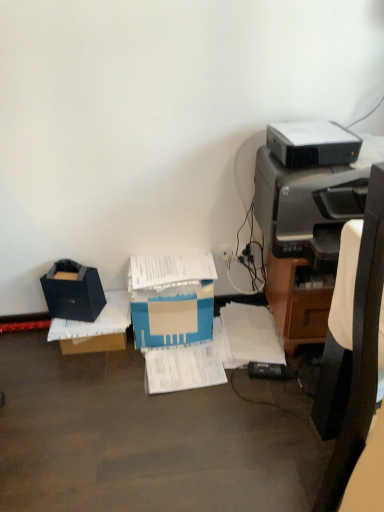
This screenshot has width=384, height=512. What do you see at coordinates (73, 292) in the screenshot?
I see `black fabric bag at left, the first storage box viewed from the top` at bounding box center [73, 292].

You are a GUI agent. You are given a task and a screenshot of the screen. Output one action in this format:
    pyautogui.click(x=<x>, y=<y>)
    Task: Click on the black plastic printer at right, which ranks as the 1th printer in bottom-to-top order
    This screenshot has width=384, height=512.
    Given the screenshot: What is the action you would take?
    pyautogui.click(x=306, y=205)

Identify the location of white paper at lower right, positioned as the first document in right-to-left order. (249, 335).

What's the angular difference between black fabric bag at left, which is counted as the second storage box, starting from the bottom, and matte black storage box at left, which is counted as the first storage box, starting from the bottom,'s facing directions?

They differ by 19.6 degrees in their facing directions.

Does point (48, 293) come in front of point (124, 310)?

No, (48, 293) is behind (124, 310).

Is black fabric bag at left, which is counted as the second storage box, starting from the bottom, completely or partially outside of matte black storage box at left, the 2th storage box positioned from the top?

black fabric bag at left, which is counted as the second storage box, starting from the bottom, lies outside matte black storage box at left, the 2th storage box positioned from the top,'s area.

Could you tell me if black fabric bag at left, which is counted as the second storage box, starting from the bottom, is facing matte black storage box at left, the 2th storage box positioned from the top?

No, black fabric bag at left, which is counted as the second storage box, starting from the bottom, does not turn towards matte black storage box at left, the 2th storage box positioned from the top.

From the image's perspective, between black plastic printer at upper right, placed as the first printer when sorted from top to bottom, and black plastic printer at right, which ranks as the 2th printer in top-to-bottom order, which one is located above?

From the image's view, black plastic printer at upper right, placed as the first printer when sorted from top to bottom, is above.

Considering the sizes of objects black plastic printer at upper right, arranged as the 2th printer when ordered from the bottom, and black plastic printer at right, which ranks as the 1th printer in bottom-to-top order, in the image provided, who is smaller, black plastic printer at upper right, arranged as the 2th printer when ordered from the bottom, or black plastic printer at right, which ranks as the 1th printer in bottom-to-top order,?

With smaller size is black plastic printer at upper right, arranged as the 2th printer when ordered from the bottom.

Which is in front, point (301, 154) or point (316, 186)?

The point (301, 154) is closer.

Considering the relative sizes of black plastic printer at upper right, placed as the first printer when sorted from top to bottom, and black plastic printer at right, which ranks as the 2th printer in top-to-bottom order, in the image provided, is black plastic printer at upper right, placed as the first printer when sorted from top to bottom, wider than black plastic printer at right, which ranks as the 2th printer in top-to-bottom order,?

No.

Is blue cardboard box at center shorter than white paper at lower right, placed as the second document when sorted from left to right?

In fact, blue cardboard box at center may be taller than white paper at lower right, placed as the second document when sorted from left to right.

Is blue cardboard box at center inside or outside of white paper at lower right, placed as the second document when sorted from left to right?

blue cardboard box at center is not enclosed by white paper at lower right, placed as the second document when sorted from left to right.

Considering their positions, is blue cardboard box at center located in front of or behind white paper at lower right, positioned as the first document in right-to-left order?

In the image, blue cardboard box at center appears in front of white paper at lower right, positioned as the first document in right-to-left order.

Is blue cardboard box at center turned away from white paper at lower right, placed as the second document when sorted from left to right?

No, blue cardboard box at center is not facing the opposite direction of white paper at lower right, placed as the second document when sorted from left to right.

Is black plastic printer at upper right, arranged as the 2th printer when ordered from the bottom, surrounded by black plastic chair at right?

No, black plastic printer at upper right, arranged as the 2th printer when ordered from the bottom, is not surrounded by black plastic chair at right.

Does point (353, 397) lie in front of point (315, 149)?

Yes, point (353, 397) is in front of point (315, 149).

From a real-world perspective, is black plastic chair at right on top of black plastic printer at upper right, placed as the first printer when sorted from top to bottom?

Incorrect, from a real-world perspective, black plastic chair at right is lower than black plastic printer at upper right, placed as the first printer when sorted from top to bottom.

Which is more to the left, black plastic chair at right or black plastic printer at upper right, placed as the first printer when sorted from top to bottom?

black plastic printer at upper right, placed as the first printer when sorted from top to bottom, is more to the left.

Is white paper at center, which is the second document from right to left, not close to black plastic chair at right?

No, white paper at center, which is the second document from right to left, is not far from black plastic chair at right.

What's the angular difference between white paper at center, placed as the 1th document when sorted from left to right, and black plastic chair at right's facing directions?

There is a 85.6-degree angle between the facing directions of white paper at center, placed as the 1th document when sorted from left to right, and black plastic chair at right.

Would you say white paper at center, placed as the 1th document when sorted from left to right, is outside black plastic chair at right?

white paper at center, placed as the 1th document when sorted from left to right, is positioned outside black plastic chair at right.

Can you confirm if white paper at center, placed as the 1th document when sorted from left to right, is wider than black plastic chair at right?

No.

Considering the sizes of white paper at lower right, placed as the second document when sorted from left to right, and black plastic chair at right in the image, is white paper at lower right, placed as the second document when sorted from left to right, bigger or smaller than black plastic chair at right?

white paper at lower right, placed as the second document when sorted from left to right, is smaller than black plastic chair at right.

Which object is more forward, white paper at lower right, positioned as the first document in right-to-left order, or black plastic chair at right?

Positioned in front is black plastic chair at right.

From a real-world perspective, is white paper at lower right, positioned as the first document in right-to-left order, positioned under black plastic chair at right based on gravity?

Yes, from a real-world perspective, white paper at lower right, positioned as the first document in right-to-left order, is below black plastic chair at right.

From the image's perspective, count 1st printers upward from the blue cardboard box at center and point to it. Please provide its 2D coordinates.

[(306, 205)]

From a real-world perspective, which object rests below the other?

blue cardboard box at center is physically lower.

Which is in front, point (295, 233) or point (194, 328)?

Positioned in front is point (295, 233).

In terms of size, does black plastic printer at right, which ranks as the 2th printer in top-to-bottom order, appear bigger or smaller than blue cardboard box at center?

Considering their sizes, black plastic printer at right, which ranks as the 2th printer in top-to-bottom order, takes up more space than blue cardboard box at center.

Where is `storage box above the matte black storage box at left, which is counted as the first storage box, starting from the bottom (from the image's perspective)`? The width and height of the screenshot is (384, 512). storage box above the matte black storage box at left, which is counted as the first storage box, starting from the bottom (from the image's perspective) is located at coordinates (73, 292).

Where is `printer behind the black plastic printer at right, which ranks as the 2th printer in top-to-bottom order`? The image size is (384, 512). printer behind the black plastic printer at right, which ranks as the 2th printer in top-to-bottom order is located at coordinates tap(312, 144).

From the picture: Estimate the real-world distances between objects in this image. Which object is further from matte black printer at right, black plastic printer at right, which ranks as the 1th printer in bottom-to-top order, or black fabric bag at left, which is counted as the second storage box, starting from the bottom?

black fabric bag at left, which is counted as the second storage box, starting from the bottom, lies further to matte black printer at right than the other object.

From the picture: From the image, which object appears to be nearer to matte black printer at right, matte black storage box at left, which is counted as the first storage box, starting from the bottom, or black plastic printer at right, which ranks as the 1th printer in bottom-to-top order?

black plastic printer at right, which ranks as the 1th printer in bottom-to-top order.

Based on the photo, when comparing their distances from matte black printer at right, does white paper at center, which is the second document from right to left, or black fabric bag at left, which is counted as the second storage box, starting from the bottom, seem closer?

white paper at center, which is the second document from right to left, is closer to matte black printer at right.

When comparing their distances from black plastic printer at right, which ranks as the 1th printer in bottom-to-top order, does matte black storage box at left, the 2th storage box positioned from the top, or black fabric bag at left, which is counted as the second storage box, starting from the bottom, seem closer?

matte black storage box at left, the 2th storage box positioned from the top, lies closer to black plastic printer at right, which ranks as the 1th printer in bottom-to-top order, than the other object.

Estimate the real-world distances between objects in this image. Which object is further from black fabric bag at left, the first storage box viewed from the top, white paper at center, placed as the 1th document when sorted from left to right, or black plastic printer at upper right, placed as the first printer when sorted from top to bottom?

black plastic printer at upper right, placed as the first printer when sorted from top to bottom, is positioned further to the anchor black fabric bag at left, the first storage box viewed from the top.

From the image, which object appears to be farther from white paper at lower right, positioned as the first document in right-to-left order, matte black printer at right or black plastic printer at right, which ranks as the 2th printer in top-to-bottom order?

The object further to white paper at lower right, positioned as the first document in right-to-left order, is black plastic printer at right, which ranks as the 2th printer in top-to-bottom order.

Which object lies further to the anchor point black plastic chair at right, black fabric bag at left, the first storage box viewed from the top, or matte black storage box at left, which is counted as the first storage box, starting from the bottom?

black fabric bag at left, the first storage box viewed from the top.

Looking at the image, which one is located further to black plastic printer at right, which ranks as the 1th printer in bottom-to-top order, matte black printer at right or black plastic printer at upper right, arranged as the 2th printer when ordered from the bottom?

black plastic printer at upper right, arranged as the 2th printer when ordered from the bottom, lies further to black plastic printer at right, which ranks as the 1th printer in bottom-to-top order, than the other object.

Locate an element on the screen. This screenshot has width=384, height=512. computer desk between black plastic chair at right and black fabric bag at left, the first storage box viewed from the top, along the z-axis is located at coordinates (307, 234).

This screenshot has width=384, height=512. Find the location of `storage box between black fabric bag at left, the first storage box viewed from the top, and black plastic printer at upper right, placed as the first printer when sorted from top to bottom, in the horizontal direction`. storage box between black fabric bag at left, the first storage box viewed from the top, and black plastic printer at upper right, placed as the first printer when sorted from top to bottom, in the horizontal direction is located at coordinates point(95,328).

The image size is (384, 512). Identify the location of computer desk located between black plastic chair at right and matte black storage box at left, the 2th storage box positioned from the top, in the depth direction. (307, 234).

I want to click on printer between blue cardboard box at center and black plastic printer at right, which ranks as the 2th printer in top-to-bottom order, in the horizontal direction, so click(x=312, y=144).